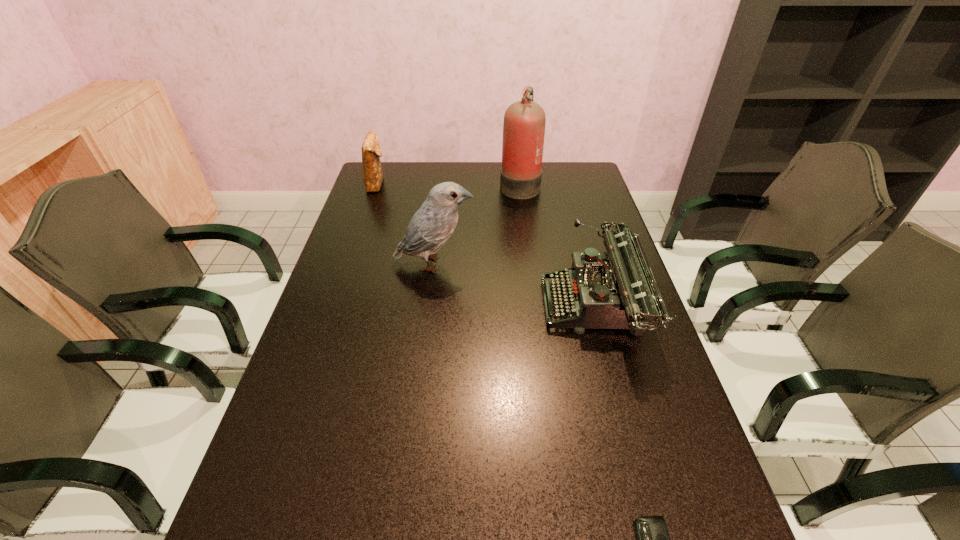
In the image, there is a desktop. At what (x,y) coordinates should I click in order to perform the action: click on free space at the right edge. Please return your answer as a coordinate pair (x, y). Looking at the image, I should click on (680, 535).

Find the location of a particular element. The width and height of the screenshot is (960, 540). vacant area between the fourth shortest object and the tallest object is located at coordinates (477, 224).

You are a GUI agent. You are given a task and a screenshot of the screen. Output one action in this format:
    pyautogui.click(x=<x>, y=<y>)
    Task: Click on the free space that is in between the clutch bag and the fourth object from right to left
    
    Given the screenshot: What is the action you would take?
    pyautogui.click(x=405, y=224)

At what (x,y) coordinates should I click in order to perform the action: click on free space that is in between the typewriter and the clutch bag. Please return your answer as a coordinate pair (x, y). Looking at the image, I should click on (486, 245).

Where is `vacant point located between the typewriter and the fourth object from right to left`? The height and width of the screenshot is (540, 960). vacant point located between the typewriter and the fourth object from right to left is located at coordinates (515, 286).

You are a GUI agent. You are given a task and a screenshot of the screen. Output one action in this format:
    pyautogui.click(x=<x>, y=<y>)
    Task: Click on the vacant region between the second tallest object and the clutch bag
    Image resolution: width=960 pixels, height=540 pixels.
    Given the screenshot: What is the action you would take?
    pyautogui.click(x=405, y=224)

The height and width of the screenshot is (540, 960). I want to click on empty location between the clutch bag and the fourth shortest object, so click(x=405, y=224).

What are the coordinates of `free point between the typewriter and the second object from left to right` in the screenshot? It's located at (515, 286).

Where is `object that is the fourth closest one to the parrot`? Image resolution: width=960 pixels, height=540 pixels. object that is the fourth closest one to the parrot is located at coordinates point(652,537).

Select which object appears as the second closest to the leftmost object. Please provide its 2D coordinates. Your answer should be formatted as a tuple, i.e. [(x, y)], where the tuple contains the x and y coordinates of a point satisfying the conditions above.

[(524, 123)]